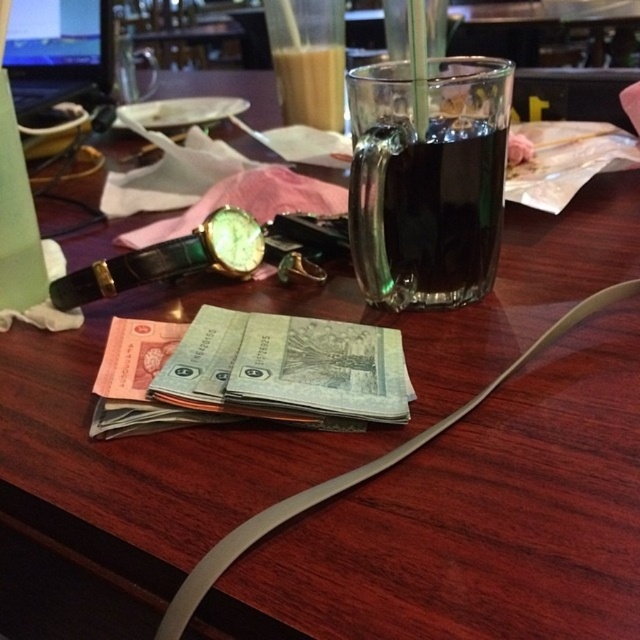
Consider the image. Which is more to the right, dark glass mug at upper center or translucent glass cup at upper center?

dark glass mug at upper center is more to the right.

Measure the distance from dark glass mug at upper center to translucent glass cup at upper center.

dark glass mug at upper center and translucent glass cup at upper center are 16.42 inches apart from each other.

Who is more distant from viewer, [486,131] or [326,122]?

The point [326,122] is behind.

The height and width of the screenshot is (640, 640). Identify the location of dark glass mug at upper center. (428, 179).

Is point (188, 611) positioned behind point (289, 76)?

No, (188, 611) is in front of (289, 76).

Who is more forward, (580, 304) or (298, 58)?

Point (580, 304) is in front.

Does point (339, 490) lie behind point (292, 49)?

No, it is not.

This screenshot has height=640, width=640. In order to click on gray rubber strap at center in this screenshot , I will do `click(355, 474)`.

Is dark glass mug at upper center bigger than gray rubber strap at center?

Actually, dark glass mug at upper center might be smaller than gray rubber strap at center.

Which of these two, dark glass mug at upper center or gray rubber strap at center, stands shorter?

Standing shorter between the two is gray rubber strap at center.

Describe the element at coordinates (428, 179) in the screenshot. This screenshot has width=640, height=640. I see `dark glass mug at upper center` at that location.

Locate an element on the screen. Image resolution: width=640 pixels, height=640 pixels. dark glass mug at upper center is located at coordinates (428, 179).